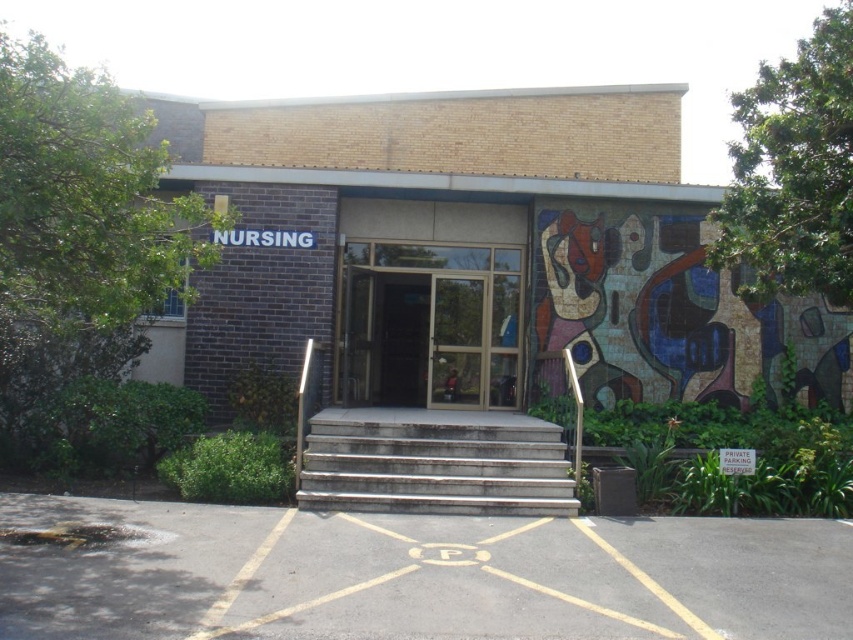
You are standing at the base of the steps leading to the entrance of the nursing building. You want to locate the transparent glass door at center. Where should you look relative to the entrance?

The transparent glass door at center is located at the entrance of the nursing building, so you should look straight ahead towards the entrance to find it.

You are a visitor arriving at the building and need to enter. You see the transparent glass door at center and the gray concrete stairs at center. Which object is closer to you as you approach the entrance?

The transparent glass door at center is closer to you because the gray concrete stairs at center is behind it.